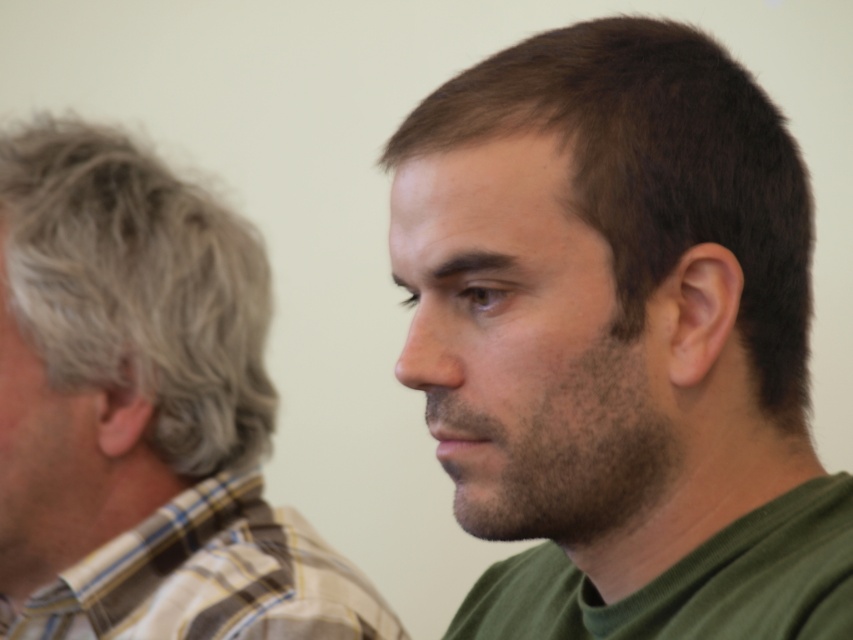
You are an artist trying to sketch the scene. You need to place the dark brown hair at right in your drawing. What are the coordinates for its position?

The coordinates for the dark brown hair at right are at point (619, 339).

You are a photographer setting up a photo shoot. You need to position a light source so that it illuminates both the dark brown hair at right and the plaid fabric shirt at left equally. Given their height difference, where should you place the light source relative to them?

The dark brown hair at right is much taller than the plaid fabric shirt at left, so placing the light source at eye level between them would ensure both receive equal illumination.

You are organizing a clothing donation drive and need to sort shirts by size. You have two plaid shirts in front of you labeled as plaid shirt at left and plaid fabric shirt at left. Which one should you place in the large size bin?

The plaid shirt at left should be placed in the large size bin because it has a larger size compared to the plaid fabric shirt at left.